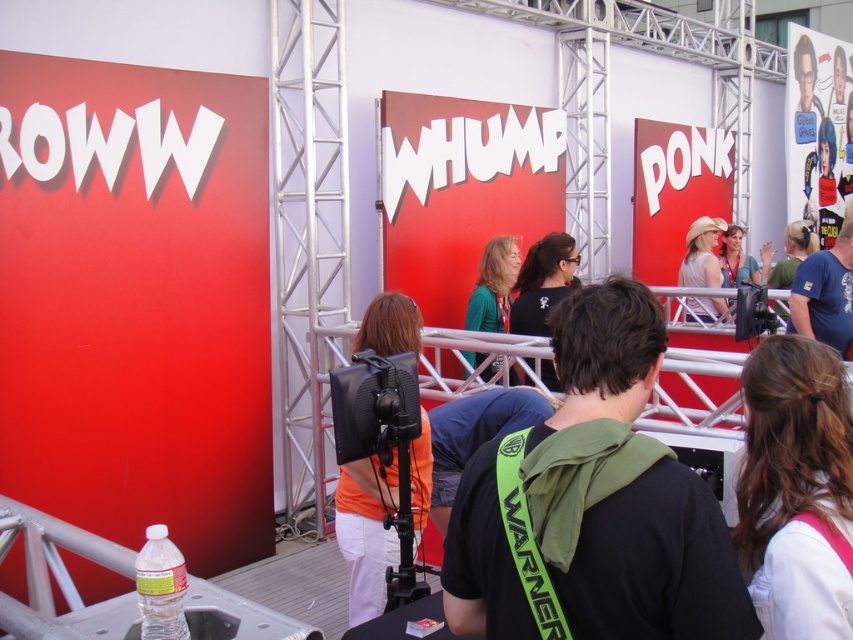
Question: Does blue t-shirt at upper right appear on the right side of black matte shirt at center?

Choices:
 (A) no
 (B) yes

Answer: (B)

Question: Among these objects, which one is nearest to the camera?

Choices:
 (A) green fabric shirt at upper right
 (B) black matte shirt at center

Answer: (B)

Question: Which object is the farthest from the light beige cowboy hat at center?

Choices:
 (A) black fabric backpack at center
 (B) blue t-shirt at upper right
 (C) green fabric shirt at upper right
 (D) matte black camera at upper right

Answer: (A)

Question: In this image, where is black fabric backpack at center located relative to white fabric at upper right?

Choices:
 (A) right
 (B) left

Answer: (B)

Question: Among these points, which one is nearest to the camera?

Choices:
 (A) (535, 275)
 (B) (708, 304)

Answer: (A)

Question: Can you confirm if black matte shirt at center is smaller than matte black camera at upper right?

Choices:
 (A) yes
 (B) no

Answer: (A)